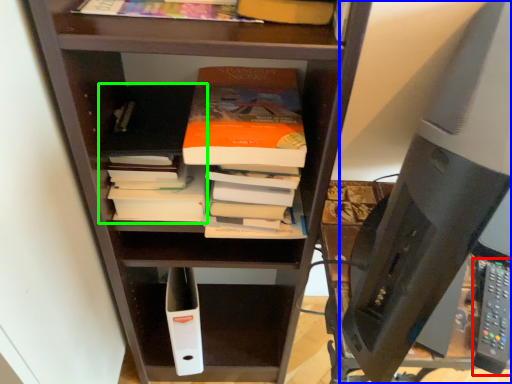
Question: Considering the real-world distances, which object is farthest from remote (highlighted by a red box)? desktop computer (highlighted by a blue box) or book (highlighted by a green box)?

Choices:
 (A) desktop computer
 (B) book

Answer: (B)